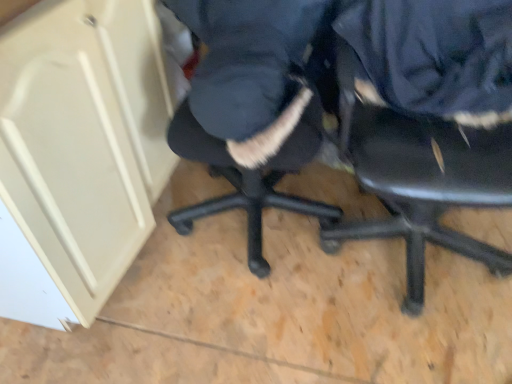
Question: Is point (77, 18) positioned closer to the camera than point (286, 167)?

Choices:
 (A) closer
 (B) farther

Answer: (A)

Question: From the image's perspective, is beige matte cabinet at upper left above or below navy blue fabric at center, the 1th clothing in the left-to-right sequence?

Choices:
 (A) above
 (B) below

Answer: (B)

Question: Which of these objects is positioned farthest from the navy blue fabric at upper right, which ranks as the first clothing in right-to-left order?

Choices:
 (A) beige matte cabinet at upper left
 (B) black plastic chair at center
 (C) navy blue fabric at center, the 1th clothing in the left-to-right sequence

Answer: (A)

Question: Estimate the real-world distances between objects in this image. Which object is closer to the navy blue fabric at upper right, which ranks as the first clothing in right-to-left order?

Choices:
 (A) black plastic chair at center
 (B) navy blue fabric at center, the second clothing from the right
 (C) beige matte cabinet at upper left

Answer: (A)